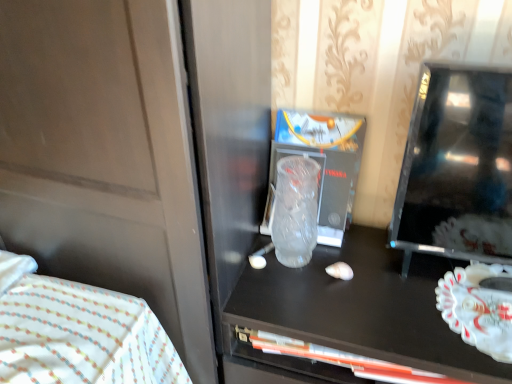
Question: Considering the relative positions of transparent frosted glass at center and white fabric bed at lower left in the image provided, is transparent frosted glass at center in front of white fabric bed at lower left?

Choices:
 (A) yes
 (B) no

Answer: (B)

Question: From the image's perspective, would you say transparent frosted glass at center is shown under white fabric bed at lower left?

Choices:
 (A) yes
 (B) no

Answer: (B)

Question: Does transparent frosted glass at center lie behind white fabric bed at lower left?

Choices:
 (A) no
 (B) yes

Answer: (B)

Question: Is transparent frosted glass at center located outside white fabric bed at lower left?

Choices:
 (A) no
 (B) yes

Answer: (B)

Question: Can you confirm if transparent frosted glass at center is positioned to the right of white fabric bed at lower left?

Choices:
 (A) no
 (B) yes

Answer: (B)

Question: Is white glossy plate at right inside or outside of white fabric bed at lower left?

Choices:
 (A) inside
 (B) outside

Answer: (B)

Question: Considering the positions of white glossy plate at right and white fabric bed at lower left in the image, is white glossy plate at right taller or shorter than white fabric bed at lower left?

Choices:
 (A) tall
 (B) short

Answer: (B)

Question: Is point (496, 332) positioned closer to the camera than point (113, 294)?

Choices:
 (A) farther
 (B) closer

Answer: (B)

Question: From a real-world perspective, relative to white fabric bed at lower left, is white glossy plate at right vertically above or below?

Choices:
 (A) above
 (B) below

Answer: (A)

Question: From a real-world perspective, is transparent frosted glass at center positioned above or below white glossy plate at right?

Choices:
 (A) above
 (B) below

Answer: (A)

Question: In terms of height, does transparent frosted glass at center look taller or shorter compared to white glossy plate at right?

Choices:
 (A) tall
 (B) short

Answer: (A)

Question: Does point (302, 264) appear closer or farther from the camera than point (437, 302)?

Choices:
 (A) farther
 (B) closer

Answer: (A)

Question: Is transparent frosted glass at center spatially inside white glossy plate at right, or outside of it?

Choices:
 (A) outside
 (B) inside

Answer: (A)

Question: From the image's perspective, is white fabric bed at lower left located above or below transparent frosted glass at center?

Choices:
 (A) above
 (B) below

Answer: (B)

Question: Looking at the image, does white fabric bed at lower left seem bigger or smaller compared to transparent frosted glass at center?

Choices:
 (A) small
 (B) big

Answer: (B)